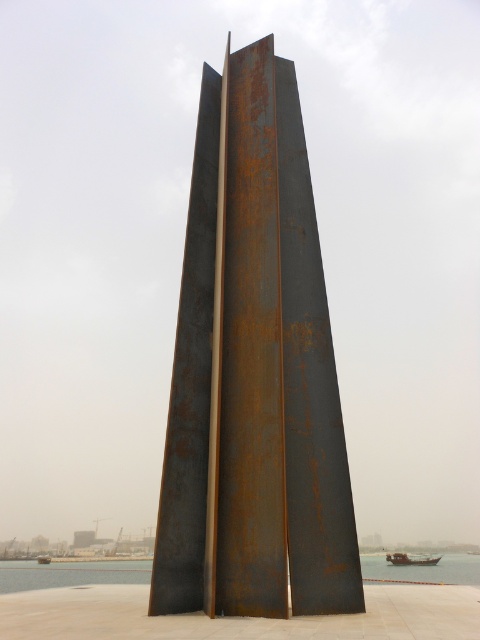
Question: Which object is the farthest from the rusty metal boat at lower right?

Choices:
 (A) clear water at center
 (B) rusty metal sculpture at center
 (C) rusty metal boat at lower left

Answer: (B)

Question: Does rusty metal boat at lower right appear over rusty metal boat at lower left?

Choices:
 (A) yes
 (B) no

Answer: (A)

Question: Considering the real-world distances, which object is farthest from the rusty metal boat at lower left?

Choices:
 (A) clear water at center
 (B) rusty metal boat at lower right

Answer: (B)

Question: Does rusty metal sculpture at center lie behind rusty metal boat at lower left?

Choices:
 (A) no
 (B) yes

Answer: (A)

Question: Which is farther from the rusty metal boat at lower left?

Choices:
 (A) rusty metal boat at lower right
 (B) rusty metal sculpture at center

Answer: (B)

Question: Can you confirm if rusty metal sculpture at center is positioned to the right of rusty metal boat at lower right?

Choices:
 (A) no
 (B) yes

Answer: (A)